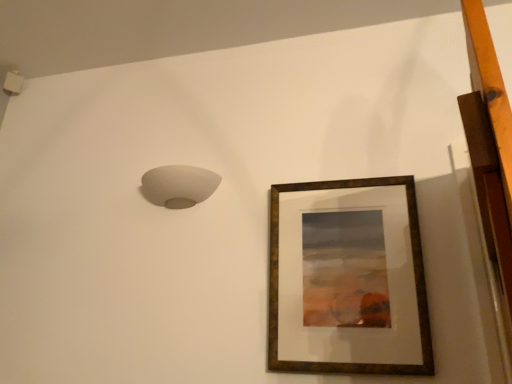
At what (x,y) coordinates should I click in order to perform the action: click on white matte lampshade at upper left. Please return your answer as a coordinate pair (x, y). This screenshot has width=512, height=384. Looking at the image, I should click on (178, 186).

What is the approximate height of white matte lampshade at upper left?

5.05 inches.

What do you see at coordinates (178, 186) in the screenshot?
I see `white matte lampshade at upper left` at bounding box center [178, 186].

Describe the element at coordinates (414, 274) in the screenshot. I see `brown wooden picture frame at upper right` at that location.

You are a GUI agent. You are given a task and a screenshot of the screen. Output one action in this format:
    pyautogui.click(x=<x>, y=<y>)
    Task: Click on the brown wooden picture frame at upper right
    The height and width of the screenshot is (384, 512).
    Given the screenshot: What is the action you would take?
    pyautogui.click(x=414, y=274)

Identify the location of white matte lampshade at upper left. The height and width of the screenshot is (384, 512). [178, 186].

Is white matte lampshade at upper left at the left side of brown wooden picture frame at upper right?

Yes.

Considering their positions, is white matte lampshade at upper left located in front of or behind brown wooden picture frame at upper right?

white matte lampshade at upper left is behind brown wooden picture frame at upper right.

Which is farther from the camera, (179, 197) or (387, 177)?

The point (179, 197) is farther from the camera.

From the image's perspective, would you say white matte lampshade at upper left is positioned over brown wooden picture frame at upper right?

Yes, from the image's perspective, white matte lampshade at upper left is above brown wooden picture frame at upper right.

From a real-world perspective, is white matte lampshade at upper left below brown wooden picture frame at upper right?

Actually, white matte lampshade at upper left is physically above brown wooden picture frame at upper right in the real world.

Is white matte lampshade at upper left thinner than brown wooden picture frame at upper right?

No.

From their relative heights in the image, would you say white matte lampshade at upper left is taller or shorter than brown wooden picture frame at upper right?

Clearly, white matte lampshade at upper left is shorter compared to brown wooden picture frame at upper right.

Considering the sizes of white matte lampshade at upper left and brown wooden picture frame at upper right in the image, is white matte lampshade at upper left bigger or smaller than brown wooden picture frame at upper right?

Considering their sizes, white matte lampshade at upper left takes up less space than brown wooden picture frame at upper right.

Is brown wooden picture frame at upper right completely or partially inside white matte lampshade at upper left?

That's incorrect, brown wooden picture frame at upper right is not inside white matte lampshade at upper left.

Would you consider white matte lampshade at upper left to be distant from brown wooden picture frame at upper right?

That's not correct — white matte lampshade at upper left is a little close to brown wooden picture frame at upper right.

Is white matte lampshade at upper left positioned with its back to brown wooden picture frame at upper right?

No, white matte lampshade at upper left is not facing away from brown wooden picture frame at upper right.

I want to click on lamp behind the brown wooden picture frame at upper right, so click(178, 186).

Is brown wooden picture frame at upper right to the left or to the right of white matte lampshade at upper left in the image?

Clearly, brown wooden picture frame at upper right is on the right of white matte lampshade at upper left in the image.

Does brown wooden picture frame at upper right come behind white matte lampshade at upper left?

No, it is in front of white matte lampshade at upper left.

Which point is more distant from viewer, (429, 339) or (196, 172)?

The point (196, 172) is more distant.

From the image's perspective, is brown wooden picture frame at upper right above or below white matte lampshade at upper left?

Clearly, from the image's perspective, brown wooden picture frame at upper right is below white matte lampshade at upper left.

From a real-world perspective, is brown wooden picture frame at upper right positioned over white matte lampshade at upper left based on gravity?

No, from a real-world perspective, brown wooden picture frame at upper right is not above white matte lampshade at upper left.

In terms of width, does brown wooden picture frame at upper right look wider or thinner when compared to white matte lampshade at upper left?

In the image, brown wooden picture frame at upper right appears to be more narrow than white matte lampshade at upper left.

Who is shorter, brown wooden picture frame at upper right or white matte lampshade at upper left?

Standing shorter between the two is white matte lampshade at upper left.

Does brown wooden picture frame at upper right have a smaller size compared to white matte lampshade at upper left?

Incorrect, brown wooden picture frame at upper right is not smaller in size than white matte lampshade at upper left.

Would you say brown wooden picture frame at upper right is inside or outside white matte lampshade at upper left?

brown wooden picture frame at upper right is outside white matte lampshade at upper left.

Based on the photo, can you see brown wooden picture frame at upper right touching white matte lampshade at upper left?

No, brown wooden picture frame at upper right is not with white matte lampshade at upper left.

Is brown wooden picture frame at upper right looking in the opposite direction of white matte lampshade at upper left?

brown wooden picture frame at upper right is not turned away from white matte lampshade at upper left.

What's the angular difference between brown wooden picture frame at upper right and white matte lampshade at upper left's facing directions?

The angular difference between brown wooden picture frame at upper right and white matte lampshade at upper left is 1.13 degrees.

The height and width of the screenshot is (384, 512). What are the coordinates of `lamp above the brown wooden picture frame at upper right (from the image's perspective)` in the screenshot? It's located at pos(178,186).

Identify the location of picture frame lying on the right of white matte lampshade at upper left. (414, 274).

This screenshot has width=512, height=384. I want to click on lamp above the brown wooden picture frame at upper right (from the image's perspective), so click(x=178, y=186).